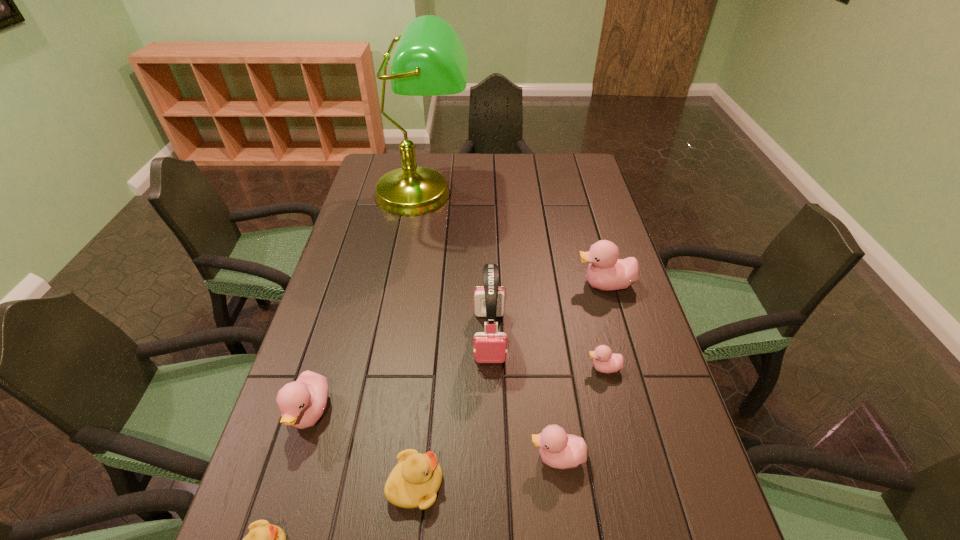
What are the coordinates of `the bigger yellow duckling` in the screenshot? It's located at (414, 482).

In order to click on the right yellow duckling in this screenshot , I will do `click(414, 482)`.

Image resolution: width=960 pixels, height=540 pixels. What are the coordinates of `the third nearest pink duckling` in the screenshot? It's located at (604, 361).

Find the location of a particular element. The width and height of the screenshot is (960, 540). the smallest pink duckling is located at coordinates (604, 361).

Identify the location of vacant space located 0.160m on the desk next to the tallest object. This screenshot has height=540, width=960. (412, 258).

Locate an element on the screen. This screenshot has height=540, width=960. blank area located on the outer surface of the fourth object from right to left is located at coordinates (492, 431).

This screenshot has height=540, width=960. Find the location of `free space located on the front-facing side of the tallest duckling`. free space located on the front-facing side of the tallest duckling is located at coordinates (462, 284).

You are a GUI agent. You are given a task and a screenshot of the screen. Output one action in this format:
    pyautogui.click(x=<x>, y=<y>)
    Task: Click on the blank space located 0.260m on the front-facing side of the tallest duckling
    This screenshot has width=960, height=540.
    Given the screenshot: What is the action you would take?
    pyautogui.click(x=488, y=284)

You are a GUI agent. You are given a task and a screenshot of the screen. Output one action in this format:
    pyautogui.click(x=<x>, y=<y>)
    Task: Click on the vacant space located 0.100m on the front-facing side of the tallest duckling
    This screenshot has height=540, width=960.
    Given the screenshot: What is the action you would take?
    pyautogui.click(x=541, y=284)

At what (x,y) coordinates should I click in order to perform the action: click on blank space located on the front-facing side of the third object from right to left. Please return your answer as a coordinate pair (x, y). The width and height of the screenshot is (960, 540). Looking at the image, I should click on (478, 457).